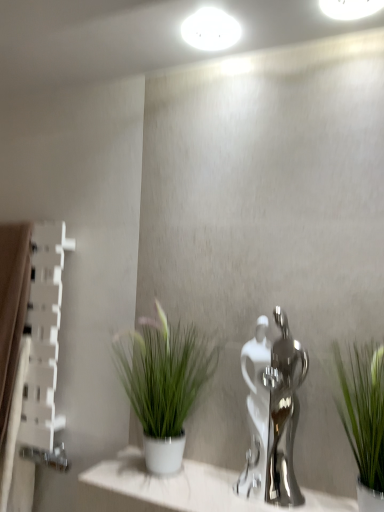
Image resolution: width=384 pixels, height=512 pixels. What are the coordinates of `free location to the left of polished chrome faucet at center` in the screenshot? It's located at (215, 493).